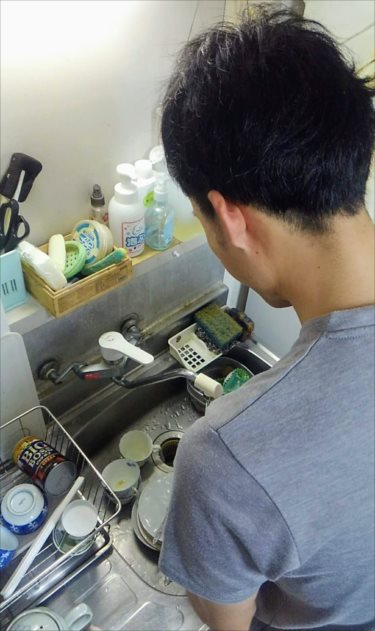
Identify the location of clear bottle. Image resolution: width=375 pixels, height=631 pixels. (156, 232).